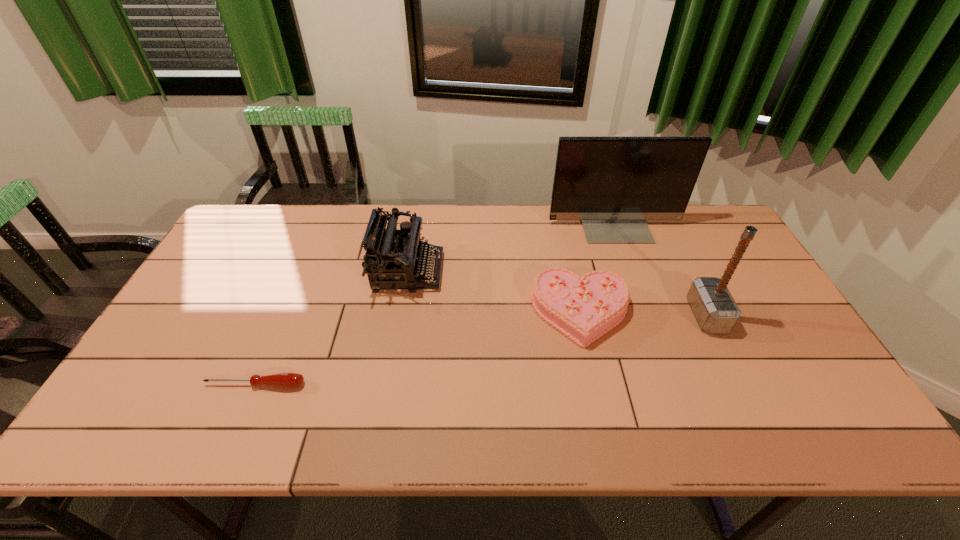
The height and width of the screenshot is (540, 960). In order to click on vacant space situated on the striking surface of the hammer in this screenshot , I will do `click(662, 315)`.

Identify the location of free space located 0.400m on the keyboard of the second object from left to right. (573, 272).

Find the location of a particular element. Image resolution: width=960 pixels, height=540 pixels. vacant space located on the front of the cake is located at coordinates (603, 413).

Where is `free point located on the back of the nearest object`? The height and width of the screenshot is (540, 960). free point located on the back of the nearest object is located at coordinates (277, 333).

You are a GUI agent. You are given a task and a screenshot of the screen. Output one action in this format:
    pyautogui.click(x=<x>, y=<y>)
    Task: Click on the computer monitor that is at the far edge
    Image resolution: width=960 pixels, height=540 pixels.
    Given the screenshot: What is the action you would take?
    pyautogui.click(x=613, y=185)

This screenshot has width=960, height=540. Find the location of `typewriter located in the far edge section of the desktop`. typewriter located in the far edge section of the desktop is located at coordinates (393, 258).

Find the location of a particular element. The width and height of the screenshot is (960, 540). object that is at the right edge is located at coordinates (613, 185).

Where is `object at the far right corner`? object at the far right corner is located at coordinates (613, 185).

Image resolution: width=960 pixels, height=540 pixels. Identify the location of free location at the far edge. (435, 211).

Locate an element on the screen. free location at the near edge of the desktop is located at coordinates (434, 421).